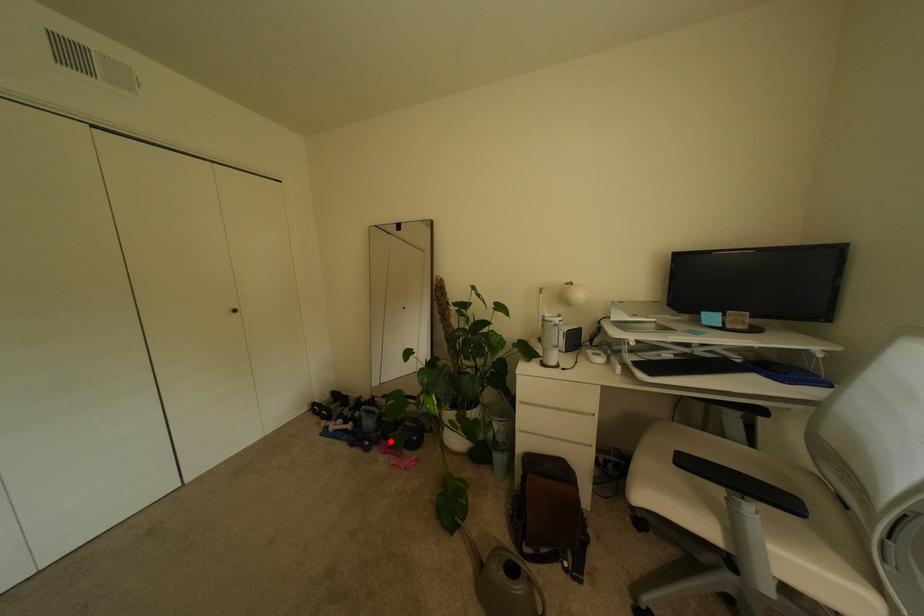
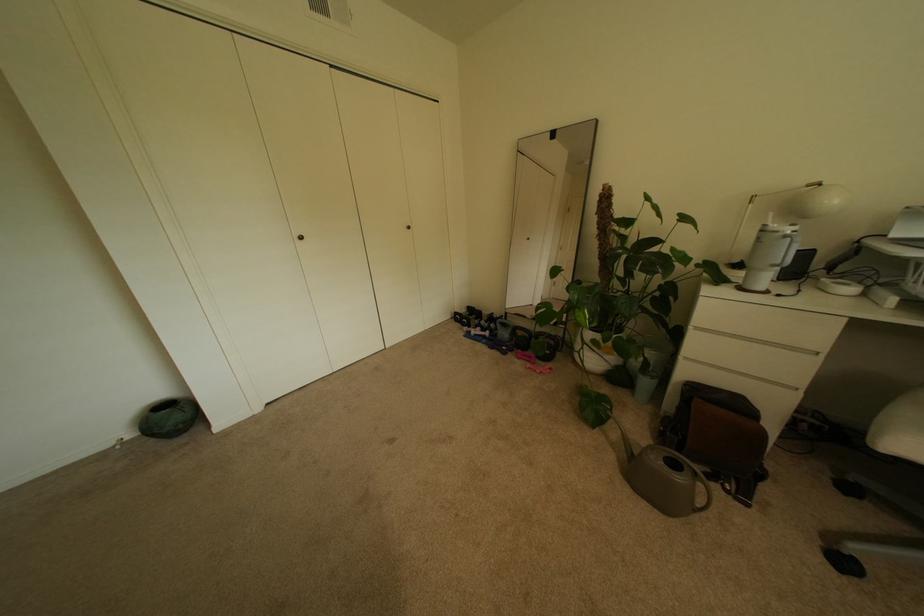
Question: I am providing you with two images of the same scene from different viewpoints. In image1, a red point is highlighted. Considering the same 3D point in image2, which of the following is correct?

Choices:
 (A) It is closer
 (B) It is farther

Answer: (A)